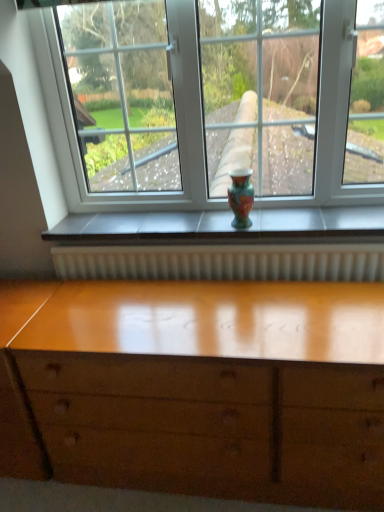
Question: Is glossy wood chest of drawers at lower center inside the boundaries of multicolored glossy vase at center, or outside?

Choices:
 (A) outside
 (B) inside

Answer: (A)

Question: Considering the positions of point (306, 485) and point (233, 170), is point (306, 485) closer or farther from the camera than point (233, 170)?

Choices:
 (A) farther
 (B) closer

Answer: (B)

Question: From a real-world perspective, is glossy wood chest of drawers at lower center above or below multicolored glossy vase at center?

Choices:
 (A) below
 (B) above

Answer: (A)

Question: From the image's perspective, is multicolored glossy vase at center positioned above or below glossy wood chest of drawers at lower center?

Choices:
 (A) above
 (B) below

Answer: (A)

Question: In terms of height, does multicolored glossy vase at center look taller or shorter compared to glossy wood chest of drawers at lower center?

Choices:
 (A) short
 (B) tall

Answer: (A)

Question: Is multicolored glossy vase at center inside or outside of glossy wood chest of drawers at lower center?

Choices:
 (A) inside
 (B) outside

Answer: (B)

Question: In the image, is multicolored glossy vase at center on the left side or the right side of glossy wood chest of drawers at lower center?

Choices:
 (A) left
 (B) right

Answer: (B)